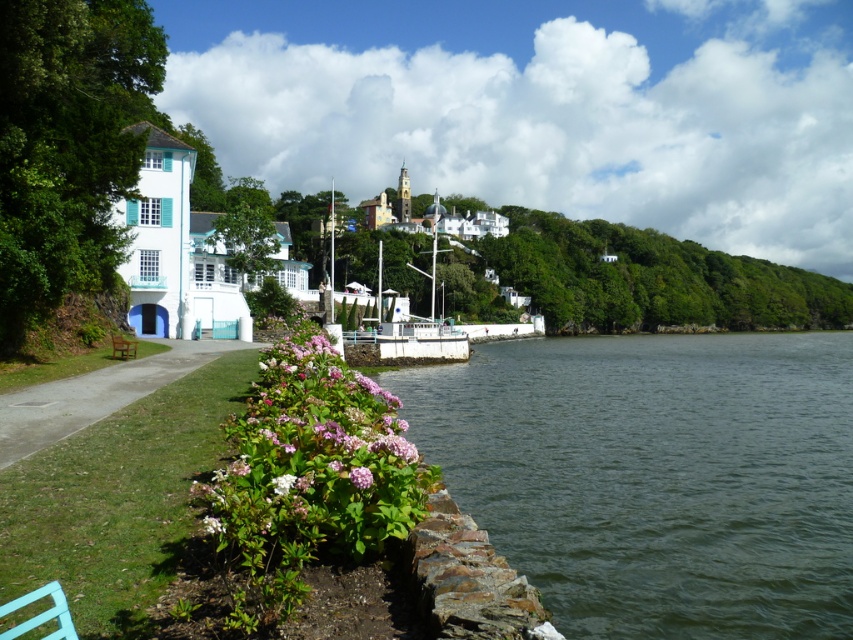
You are standing at the riverside and want to take a photo. There are two points marked in the scene, point 1 at coordinates point (383, 448) and point 2 at coordinates point (126, 355). Which point will appear larger in your photo?

Point (383, 448) will appear larger in the photo because it is closer to the camera than point (126, 355).

What is the relationship between the width of the greenish water at lower right and the gray concrete path at lower left in the scene?

The greenish water at lower right is wider than the gray concrete path at lower left.

You are standing at the riverside and want to take a photo of the greenish water at lower right and the gray concrete path at lower left. Which object is nearer to you when you focus your camera?

The greenish water at lower right is closer to the viewer than the gray concrete path at lower left, so when focusing your camera, the greenish water at lower right will be nearer to you.